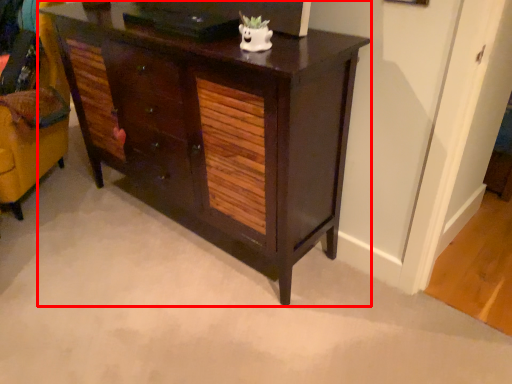
Question: From the image's perspective, where is chest of drawers (annotated by the red box) located relative to swivel chair?

Choices:
 (A) above
 (B) below

Answer: (B)